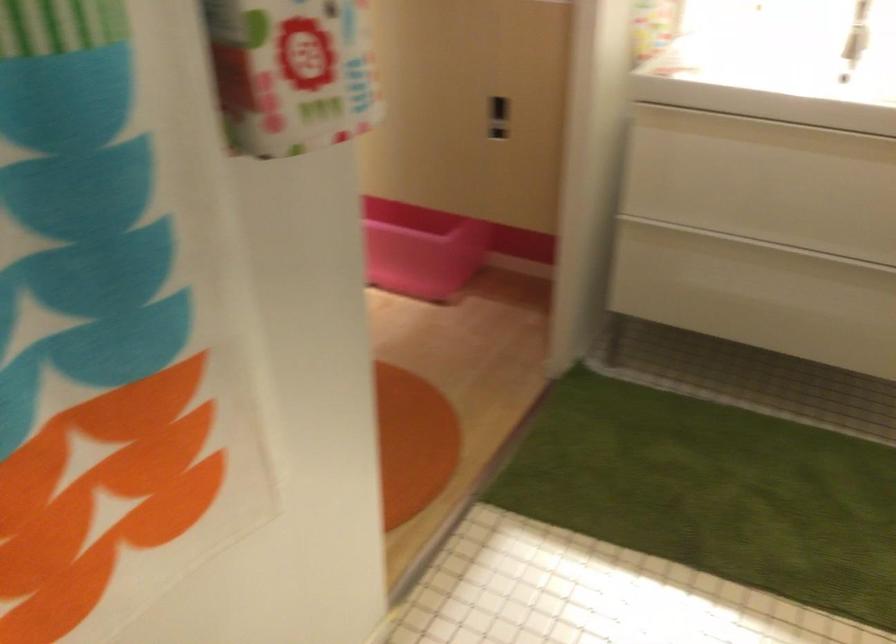
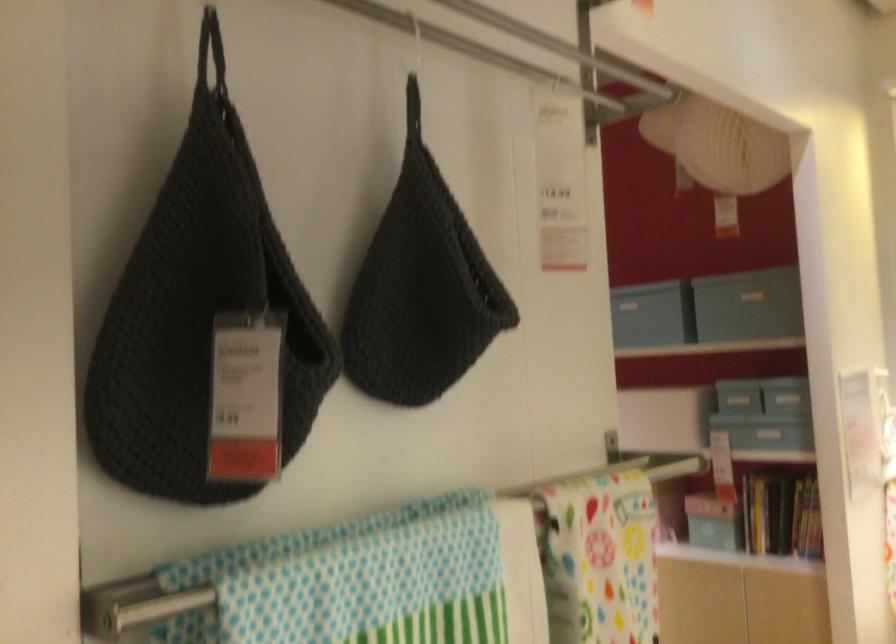
How did the camera likely rotate?

The camera rotated toward left-up.